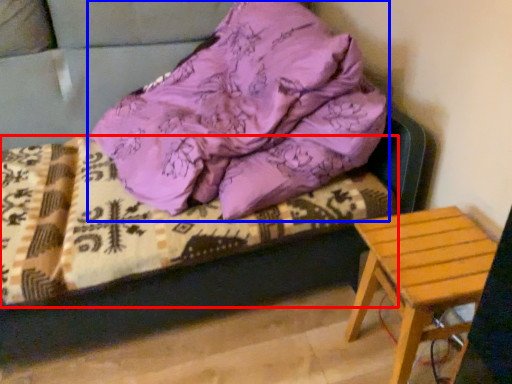
Question: Which object is further to the camera taking this photo, bedding (highlighted by a red box) or pillow (highlighted by a blue box)?

Choices:
 (A) bedding
 (B) pillow

Answer: (A)